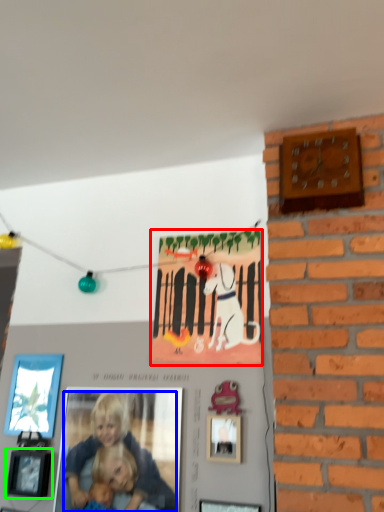
Question: Which object is the closest to the postcard (highlighted by a red box)? Choose among these: person (highlighted by a blue box) or picture frame (highlighted by a green box).

Choices:
 (A) person
 (B) picture frame

Answer: (A)